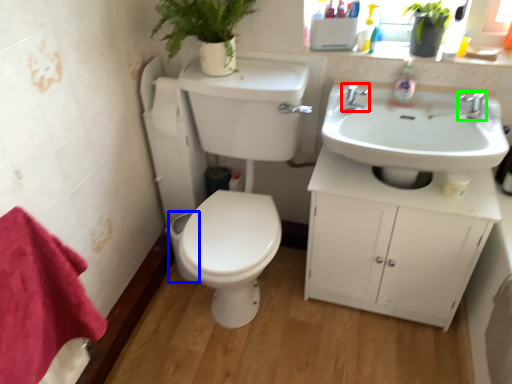
Question: Considering the real-world distances, which object is farthest from tap (highlighted by a red box)? toilet bowl (highlighted by a blue box) or tap (highlighted by a green box)?

Choices:
 (A) toilet bowl
 (B) tap

Answer: (A)